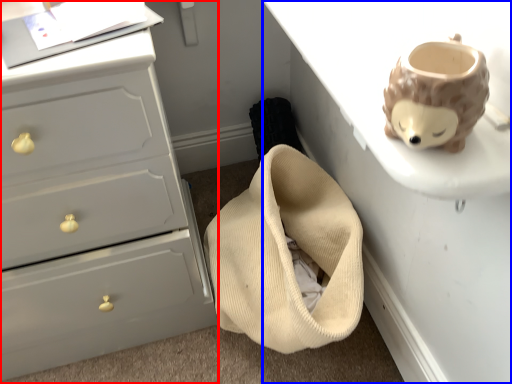
Question: Among these objects, which one is farthest to the camera, chest of drawers (highlighted by a red box) or table (highlighted by a blue box)?

Choices:
 (A) chest of drawers
 (B) table

Answer: (A)